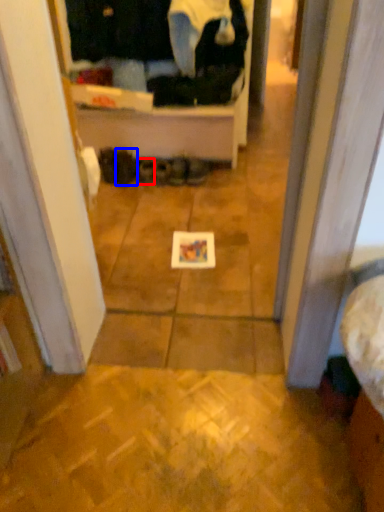
Question: Which point is closer to the camera, footwear (highlighted by a red box) or footwear (highlighted by a blue box)?

Choices:
 (A) footwear
 (B) footwear

Answer: (B)